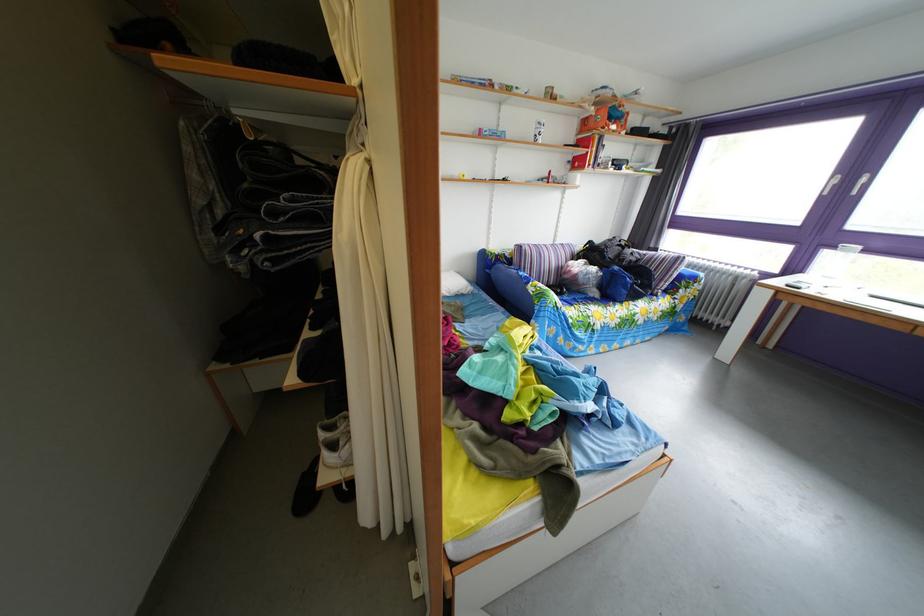
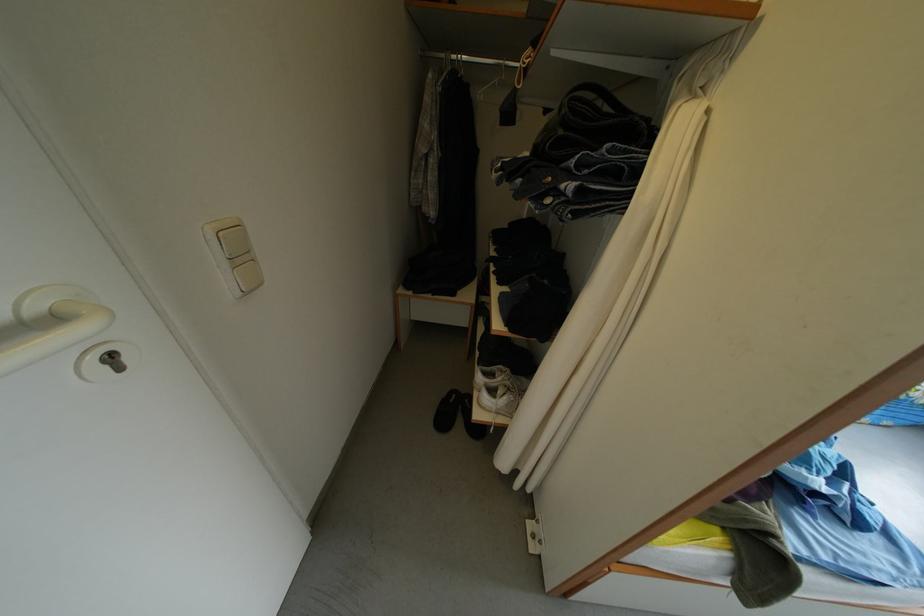
Find the pixel in the second image that matches pixel 345 454 in the first image.

(503, 400)